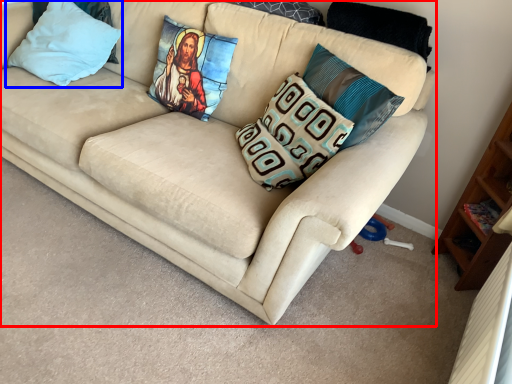
Question: Which of the following is the farthest to the observer, studio couch (highlighted by a red box) or pillow (highlighted by a blue box)?

Choices:
 (A) studio couch
 (B) pillow

Answer: (B)